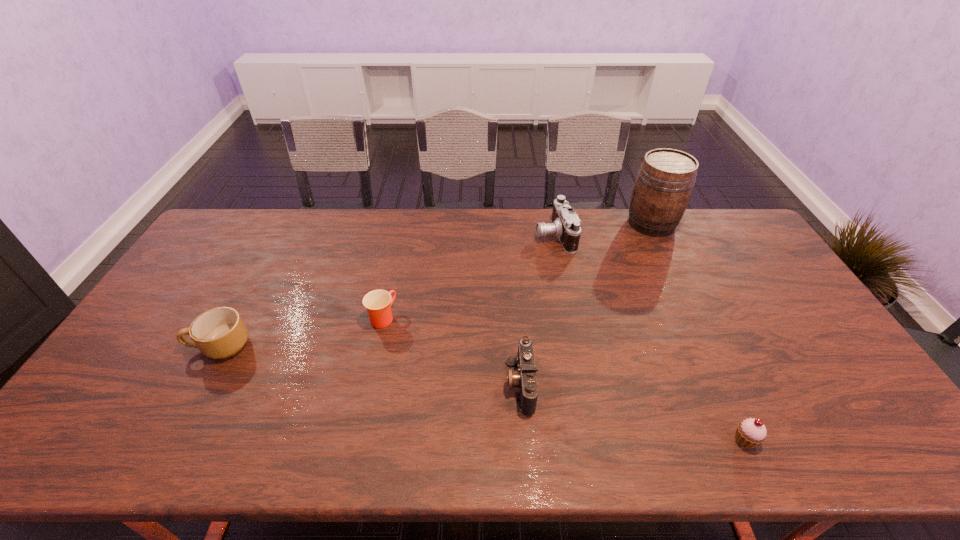
At what (x,y) coordinates should I click in order to perform the action: click on vacant space positioned on the right of the cupcake. Please return your answer as a coordinate pair (x, y). The width and height of the screenshot is (960, 540). Looking at the image, I should click on (801, 440).

Find the location of `cider that is positioned at the far edge`. cider that is positioned at the far edge is located at coordinates click(x=663, y=187).

This screenshot has width=960, height=540. I want to click on camera present at the far edge, so click(565, 225).

Where is `object present at the near edge`? object present at the near edge is located at coordinates (750, 432).

Locate an element on the screen. The image size is (960, 540). free location at the far edge of the desktop is located at coordinates (705, 241).

Find the location of a particular element. The image size is (960, 540). vacant space at the near edge of the desktop is located at coordinates (552, 429).

The height and width of the screenshot is (540, 960). In the image, there is a desktop. Identify the location of vacant space at the right edge. (857, 423).

Locate an element on the screen. This screenshot has width=960, height=540. free location at the far left corner is located at coordinates (226, 235).

The image size is (960, 540). Identify the location of vacant space at the far right corner of the desktop. (729, 215).

Locate an element on the screen. Image resolution: width=960 pixels, height=540 pixels. vacant space that is in between the shorter camera and the tallest object is located at coordinates (586, 303).